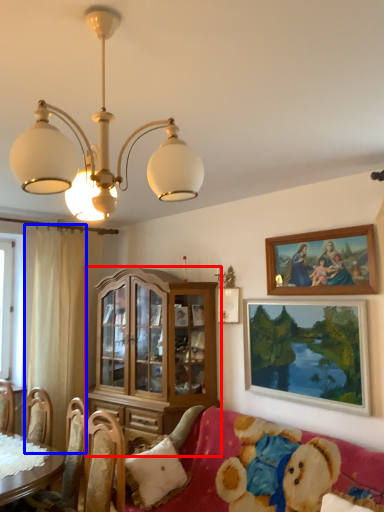
Question: Which of the following is the farthest to the observer, cabinetry (highlighted by a red box) or curtain (highlighted by a blue box)?

Choices:
 (A) cabinetry
 (B) curtain

Answer: (B)